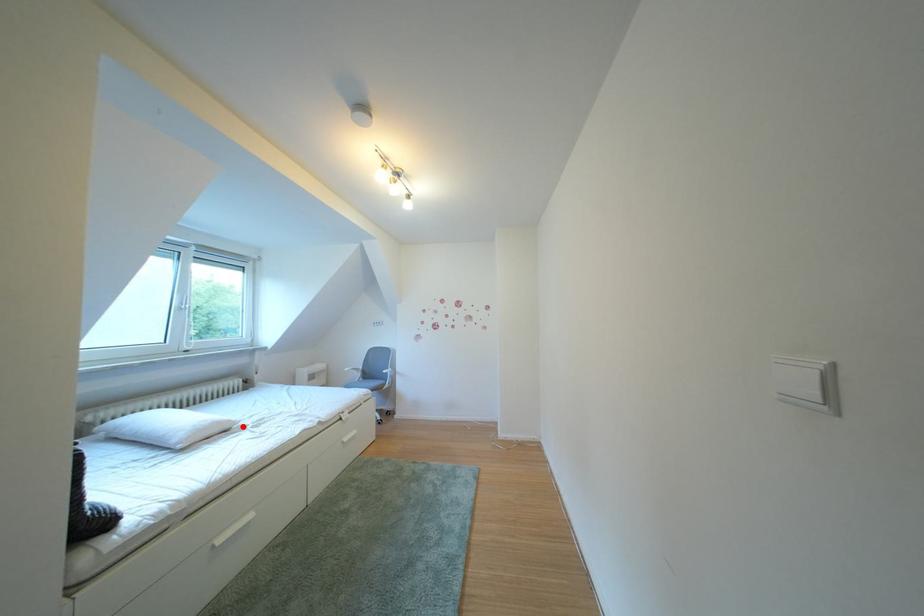
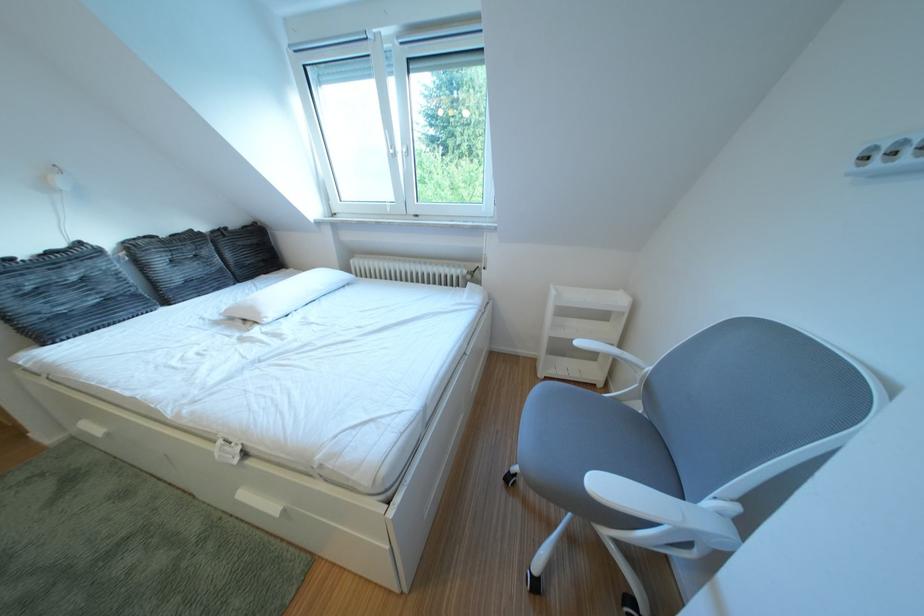
Find the pixel in the second image that matches the highlighted location in the first image.

(273, 318)